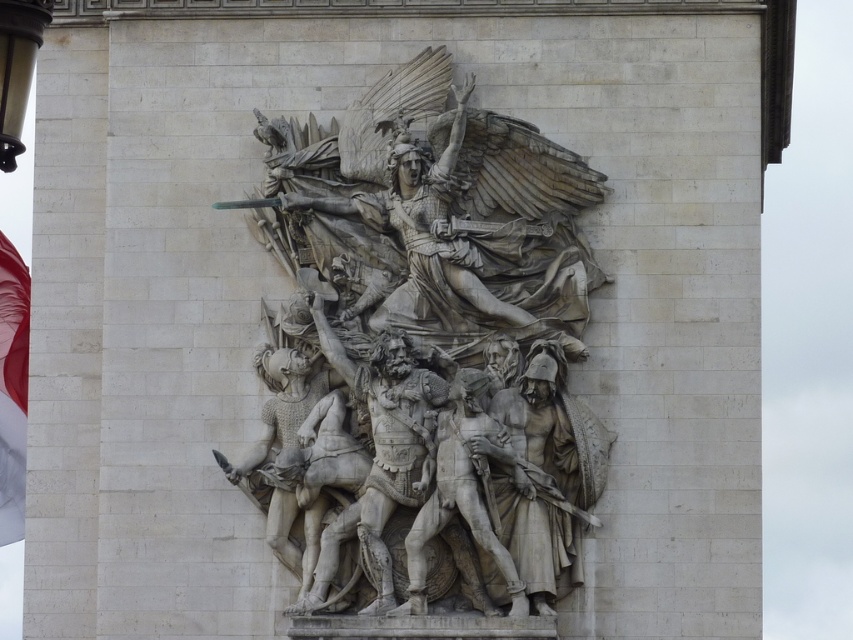
You are an art conservator examining the bas relief sculpture. You notice two points of interest marked at coordinates point [509,502] and point [12,429]. Which point is closer to the viewer?

Point [509,502] is in front of point [12,429], so it is closer to the viewer.

You are an art conservator examining the bas relief sculpture. You notice the white stone sculpture at center and the red fabric flag at left. Which object is placed higher in the composition?

The white stone sculpture at center is positioned over the red fabric flag at left, so it is placed higher in the composition.

You are an architect planning to install a new light fixture between the white stone sculpture at center and the red fabric flag at left. The light fixture requires a minimum of 20 meters of space between them to function properly. Based on the distance provided, will the light fixture work correctly?

The white stone sculpture at center and the red fabric flag at left are 22.73 meters apart, which exceeds the minimum required 20 meters. Therefore, the light fixture will work correctly as there is sufficient space between them.